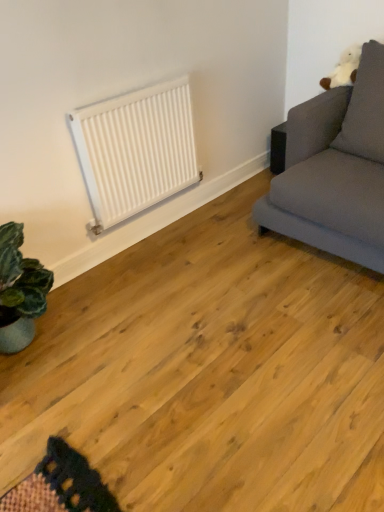
Question: Looking at their shapes, would you say white plush pillow at upper right is wider or thinner than white matte radiator at upper center?

Choices:
 (A) wide
 (B) thin

Answer: (A)

Question: Based on their positions, is white plush pillow at upper right located to the left or right of white matte radiator at upper center?

Choices:
 (A) left
 (B) right

Answer: (B)

Question: Considering the real-world distances, which object is farthest from the white matte radiator at upper center?

Choices:
 (A) white plush pillow at upper right
 (B) gray fabric couch at upper right

Answer: (A)

Question: Which of these objects is positioned closest to the gray fabric couch at upper right?

Choices:
 (A) white matte radiator at upper center
 (B) white plush pillow at upper right

Answer: (B)